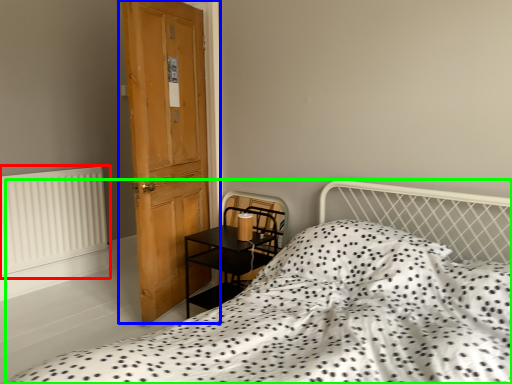
Question: Which object is the closest to the radiator (highlighted by a red box)? Choose among these: door (highlighted by a blue box) or bed (highlighted by a green box).

Choices:
 (A) door
 (B) bed

Answer: (A)